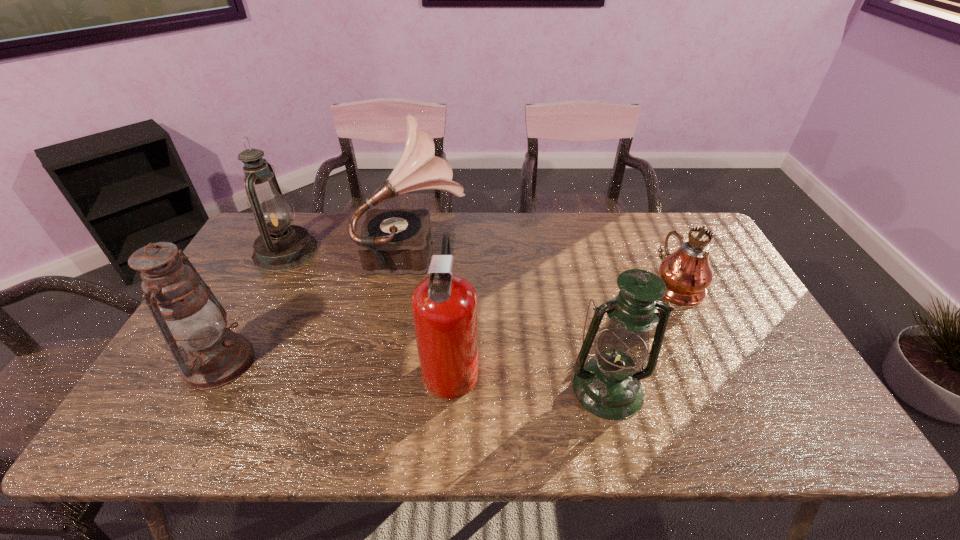
The image size is (960, 540). Find the location of `free space between the fire extinguisher and the rightmost object`. free space between the fire extinguisher and the rightmost object is located at coordinates (564, 324).

Image resolution: width=960 pixels, height=540 pixels. Identify the location of object that is the closest to the record player. (280, 246).

Identify which object is the third nearest to the record player. Please provide its 2D coordinates. Your answer should be formatted as a tuple, i.e. [(x, y)], where the tuple contains the x and y coordinates of a point satisfying the conditions above.

[(189, 316)]

What are the coordinates of `oil lamp that stands as the second closest to the fire extinguisher` in the screenshot? It's located at (189, 316).

Identify the location of oil lamp object that ranks as the second closest to the fire extinguisher. This screenshot has width=960, height=540. (189, 316).

Where is `free space that satisfies the following two spatial constraints: 1. from the horn of the rightmost object; 2. on the left side of the record player`? This screenshot has width=960, height=540. free space that satisfies the following two spatial constraints: 1. from the horn of the rightmost object; 2. on the left side of the record player is located at coordinates (411, 284).

Locate an element on the screen. vacant region that satisfies the following two spatial constraints: 1. from the horn of the fifth object from left to right; 2. on the left side of the record player is located at coordinates (393, 389).

Image resolution: width=960 pixels, height=540 pixels. I want to click on vacant area that satisfies the following two spatial constraints: 1. from the horn of the rightmost object; 2. on the left side of the record player, so click(x=411, y=284).